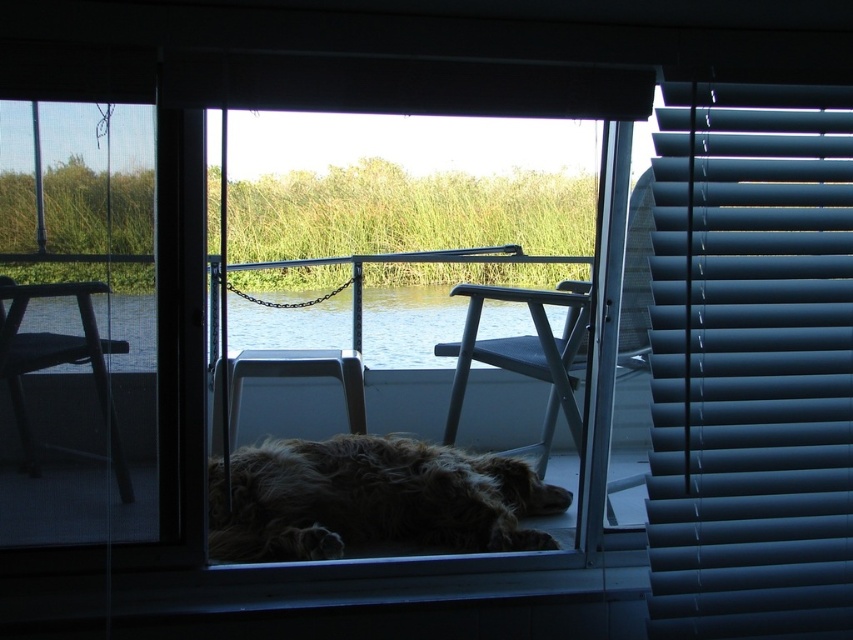
You are a photographer trying to capture the dog in the scene. Since the fuzzy brown fur at center and clear water at center are both in the frame, which one is shorter in height?

The fuzzy brown fur at center is shorter than the clear water at center.

You are trying to determine if the fuzzy brown fur at center can fit entirely within the clear water at center. Based on their widths, can it?

The fuzzy brown fur at center is narrower than the clear water at center, so it can fit entirely within the clear water at center.

From the picture: You are standing inside the room looking through the partially open sliding glass door. There are two points marked in the scene, point (584,289) and point (318,362). Which point is closer to you?

Point (584,289) is further to the viewer than point (318,362), so the point closer to you is point (318,362).